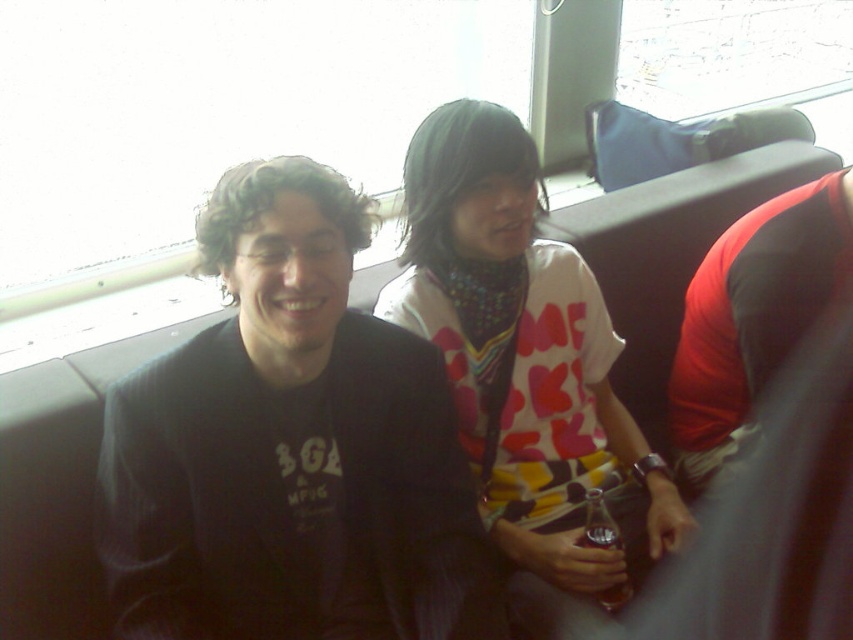
Question: Among these points, which one is nearest to the camera?

Choices:
 (A) (306, 326)
 (B) (518, 145)

Answer: (A)

Question: Does dark gray sweater at center appear on the left side of printed cotton shirt at center?

Choices:
 (A) no
 (B) yes

Answer: (B)

Question: Is dark gray sweater at center to the right of printed cotton shirt at center from the viewer's perspective?

Choices:
 (A) no
 (B) yes

Answer: (A)

Question: Does dark gray sweater at center appear on the right side of printed cotton shirt at center?

Choices:
 (A) no
 (B) yes

Answer: (A)

Question: Which object is closer to the camera taking this photo?

Choices:
 (A) printed cotton shirt at center
 (B) dark gray sweater at center

Answer: (B)